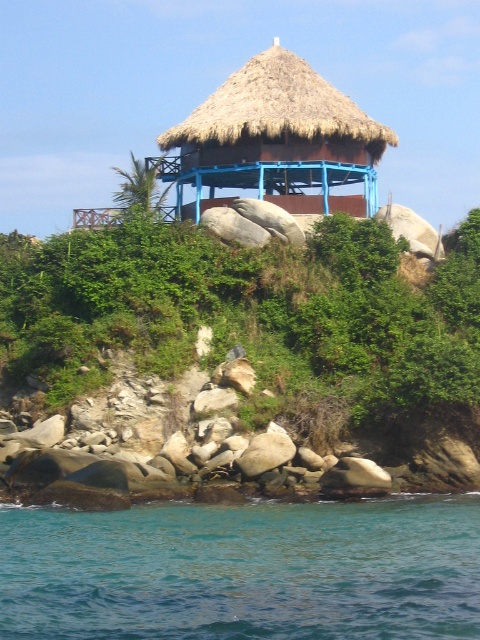
Question: Can you confirm if blue liquid water at lower center is thinner than thatched straw hut at center?

Choices:
 (A) no
 (B) yes

Answer: (A)

Question: Which point is closer to the camera taking this photo?

Choices:
 (A) tap(283, 605)
 (B) tap(356, 269)

Answer: (A)

Question: Which point is closer to the camera?

Choices:
 (A) (300, 145)
 (B) (155, 260)
 (C) (447, 502)

Answer: (C)

Question: Which object appears farthest from the camera in this image?

Choices:
 (A) blue liquid water at lower center
 (B) thatched straw hut at center
 (C) green leafy shrubs at center

Answer: (B)

Question: Does blue liquid water at lower center appear on the right side of thatched straw hut at center?

Choices:
 (A) no
 (B) yes

Answer: (A)

Question: Does green leafy shrubs at center have a smaller size compared to blue liquid water at lower center?

Choices:
 (A) no
 (B) yes

Answer: (A)